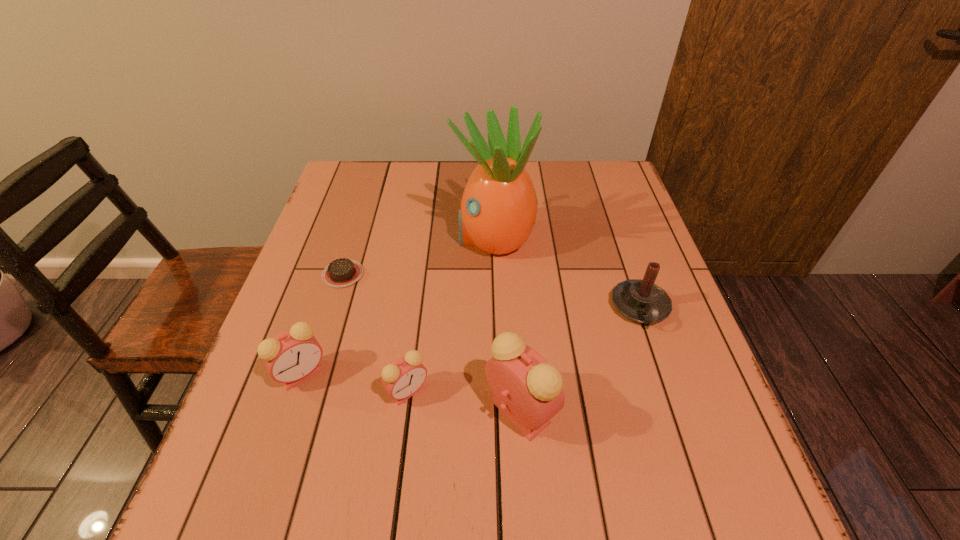
Locate an element on the screen. This screenshot has height=540, width=960. vacant point located between the tallest object and the shortest object is located at coordinates (418, 255).

At what (x,y) coordinates should I click in order to perform the action: click on blank region between the shortest object and the second alarm clock from left to right. Please return your answer as a coordinate pair (x, y). Looking at the image, I should click on (375, 333).

You are a GUI agent. You are given a task and a screenshot of the screen. Output one action in this format:
    pyautogui.click(x=<x>, y=<y>)
    Task: Click on the free space between the pineapple and the shortest alarm clock
    
    Given the screenshot: What is the action you would take?
    pyautogui.click(x=450, y=314)

Locate an element on the screen. free spot between the shortest object and the third object from left to right is located at coordinates (375, 333).

Image resolution: width=960 pixels, height=540 pixels. Identify the location of empty space that is in between the pineapple and the rightmost object. (567, 273).

Point out which object is positioned as the fifth nearest to the pineapple. Please provide its 2D coordinates. Your answer should be formatted as a tuple, i.e. [(x, y)], where the tuple contains the x and y coordinates of a point satisfying the conditions above.

[(292, 356)]

Point out which object is positioned as the fifth nearest to the tallest alarm clock. Please provide its 2D coordinates. Your answer should be formatted as a tuple, i.e. [(x, y)], where the tuple contains the x and y coordinates of a point satisfying the conditions above.

[(341, 272)]

At what (x,y) coordinates should I click in order to perform the action: click on alarm clock that is the second closest one to the pineapple. Please return your answer as a coordinate pair (x, y). This screenshot has width=960, height=540. Looking at the image, I should click on (527, 390).

I want to click on alarm clock object that ranks as the third closest to the tallest object, so click(x=292, y=356).

I want to click on free space that satisfies the following two spatial constraints: 1. on the side of the candle with the handle loop; 2. on the face of the tallest alarm clock, so click(x=676, y=410).